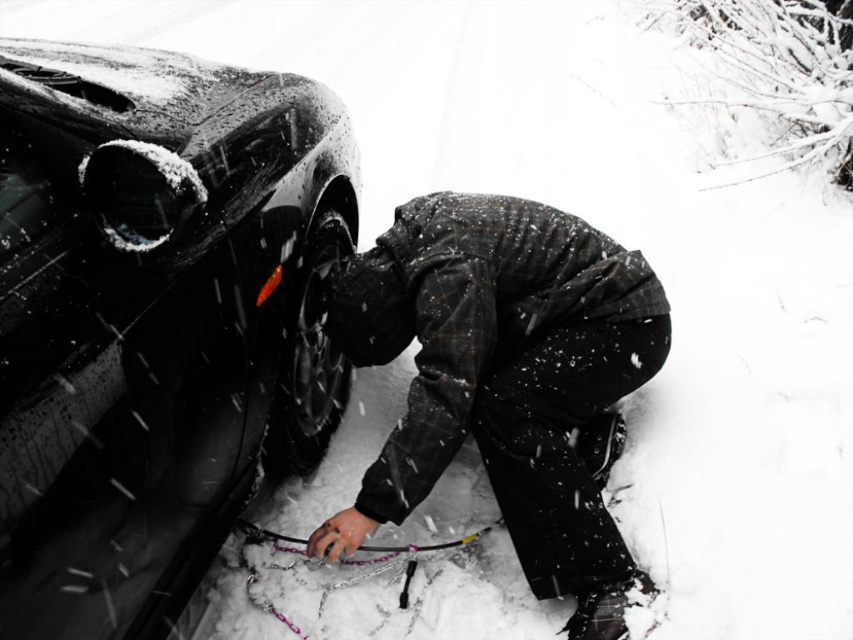
You are a pedestrian trying to cross the road safely. You see a glossy black car at left and a dark woolen jacket at lower center. Which object is closer to you?

The glossy black car at left is closer to you because it is in front of the dark woolen jacket at lower center.

You are a delivery robot with a 40 cm wide package. You need to deliver it to the black rubber tire at center. The dark woolen jacket at lower center is in the way. Can you pass through the space between them?

The distance between the dark woolen jacket at lower center and black rubber tire at center is 56.14 centimeters. Since the package is 40 cm wide, it can fit through the space between them.

You are a delivery robot with a width of 0.8 meters. You need to navigate around the glossy black car at left. How much space do you have to pass safely?

The glossy black car at left is 1.13 meters away from the camera. Since the robot is 0.8 meters wide, there is sufficient space to pass safely as the distance is greater than the robot width.